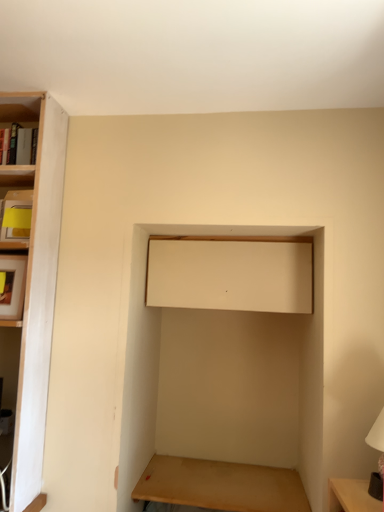
What do you see at coordinates (378, 440) in the screenshot? The height and width of the screenshot is (512, 384). I see `white glossy table lamp at lower right` at bounding box center [378, 440].

What do you see at coordinates (231, 273) in the screenshot? The image size is (384, 512). I see `beige matte cabinet at upper center` at bounding box center [231, 273].

The width and height of the screenshot is (384, 512). I want to click on white glossy table lamp at lower right, so click(378, 440).

Could you tell me if wooden table at lower center is turned towards beige matte cabinet at upper center?

No.

Looking at this image, is wooden table at lower center in front of beige matte cabinet at upper center?

Yes, wooden table at lower center is in front of beige matte cabinet at upper center.

Does point (243, 475) come behind point (288, 253)?

Yes, point (243, 475) is farther from viewer.

From the image's perspective, would you say wooden table at lower center is shown under beige matte cabinet at upper center?

Indeed, from the image's perspective, wooden table at lower center is shown beneath beige matte cabinet at upper center.

What's the angular difference between wooden table at lower center and white glossy table lamp at lower right's facing directions?

wooden table at lower center and white glossy table lamp at lower right are facing 85 degrees away from each other.

Considering the sizes of objects wooden table at lower center and white glossy table lamp at lower right in the image provided, who is shorter, wooden table at lower center or white glossy table lamp at lower right?

With less height is wooden table at lower center.

Which object is closer to the camera, wooden table at lower center or white glossy table lamp at lower right?

white glossy table lamp at lower right is closer to the camera.

In the scene shown: How distant is white glossy table lamp at lower right from wooden table at lower center?

A distance of 31.28 inches exists between white glossy table lamp at lower right and wooden table at lower center.

From a real-world perspective, who is located higher, white glossy table lamp at lower right or wooden table at lower center?

white glossy table lamp at lower right, from a real-world perspective.

Is point (381, 423) positioned behind point (186, 461)?

No.

How different are the orientations of white glossy table lamp at lower right and wooden table at lower center in degrees?

white glossy table lamp at lower right and wooden table at lower center are facing 85 degrees away from each other.

Would you consider beige matte cabinet at upper center to be distant from white glossy table lamp at lower right?

No, beige matte cabinet at upper center is in close proximity to white glossy table lamp at lower right.

From the image's perspective, is beige matte cabinet at upper center positioned above or below white glossy table lamp at lower right?

From the image's perspective, beige matte cabinet at upper center appears above white glossy table lamp at lower right.

Is beige matte cabinet at upper center behind white glossy table lamp at lower right?

Yes, it is.

Can you confirm if beige matte cabinet at upper center is wider than white glossy table lamp at lower right?

Yes, beige matte cabinet at upper center is wider than white glossy table lamp at lower right.

Which object is positioned more to the left, beige matte cabinet at upper center or wooden table at lower center?

Positioned to the left is wooden table at lower center.

Considering the relative positions of beige matte cabinet at upper center and wooden table at lower center in the image provided, is beige matte cabinet at upper center in front of wooden table at lower center?

No, beige matte cabinet at upper center is further to the viewer.

Is beige matte cabinet at upper center not within wooden table at lower center?

Yes, beige matte cabinet at upper center is not within wooden table at lower center.

Considering the positions of objects white glossy table lamp at lower right and beige matte cabinet at upper center in the image provided, who is behind, white glossy table lamp at lower right or beige matte cabinet at upper center?

beige matte cabinet at upper center is further from the camera.

Is white glossy table lamp at lower right wider than beige matte cabinet at upper center?

No.

Identify the location of cabinet positioned vertically above the white glossy table lamp at lower right (from a real-world perspective). This screenshot has width=384, height=512. 231,273.

Image resolution: width=384 pixels, height=512 pixels. In order to click on table below the beige matte cabinet at upper center (from a real-world perspective) in this screenshot , I will do `click(221, 485)`.

Where is `table lamp in front of the wooden table at lower center`? This screenshot has height=512, width=384. table lamp in front of the wooden table at lower center is located at coordinates (378, 440).

When comparing their distances from wooden table at lower center, does beige matte cabinet at upper center or white glossy table lamp at lower right seem further?

beige matte cabinet at upper center is further to wooden table at lower center.

Looking at the image, which one is located closer to white glossy table lamp at lower right, beige matte cabinet at upper center or wooden table at lower center?

Among the two, beige matte cabinet at upper center is located nearer to white glossy table lamp at lower right.

Considering their positions, is wooden table at lower center positioned closer to white glossy table lamp at lower right than beige matte cabinet at upper center?

beige matte cabinet at upper center lies closer to white glossy table lamp at lower right than the other object.

Based on their spatial positions, is wooden table at lower center or white glossy table lamp at lower right closer to beige matte cabinet at upper center?

white glossy table lamp at lower right is positioned closer to the anchor beige matte cabinet at upper center.

Which object lies further to the anchor point beige matte cabinet at upper center, white glossy table lamp at lower right or wooden table at lower center?

wooden table at lower center lies further to beige matte cabinet at upper center than the other object.

Looking at the image, which one is located closer to wooden table at lower center, white glossy table lamp at lower right or beige matte cabinet at upper center?

Based on the image, white glossy table lamp at lower right appears to be nearer to wooden table at lower center.

Identify the location of table lamp between beige matte cabinet at upper center and wooden table at lower center vertically. This screenshot has height=512, width=384. (378, 440).